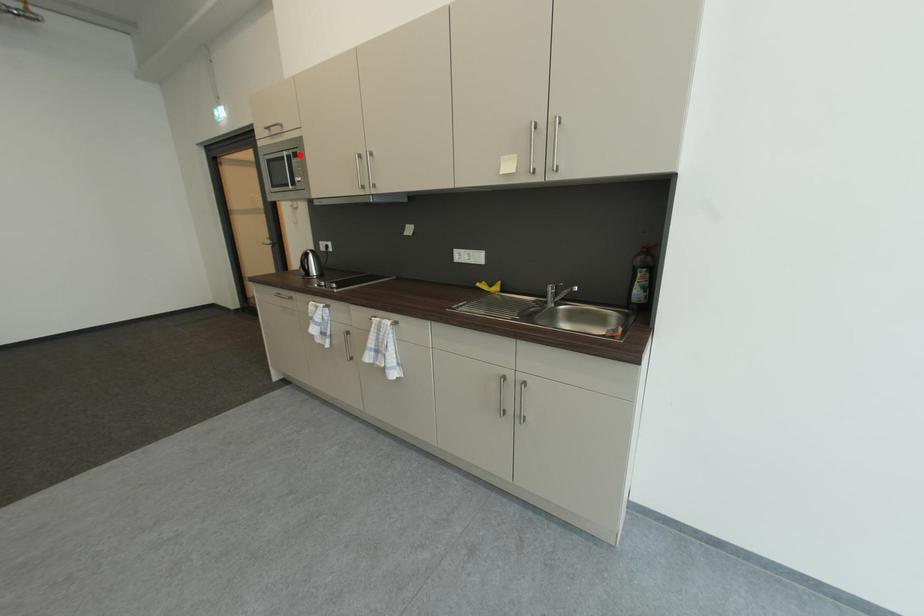
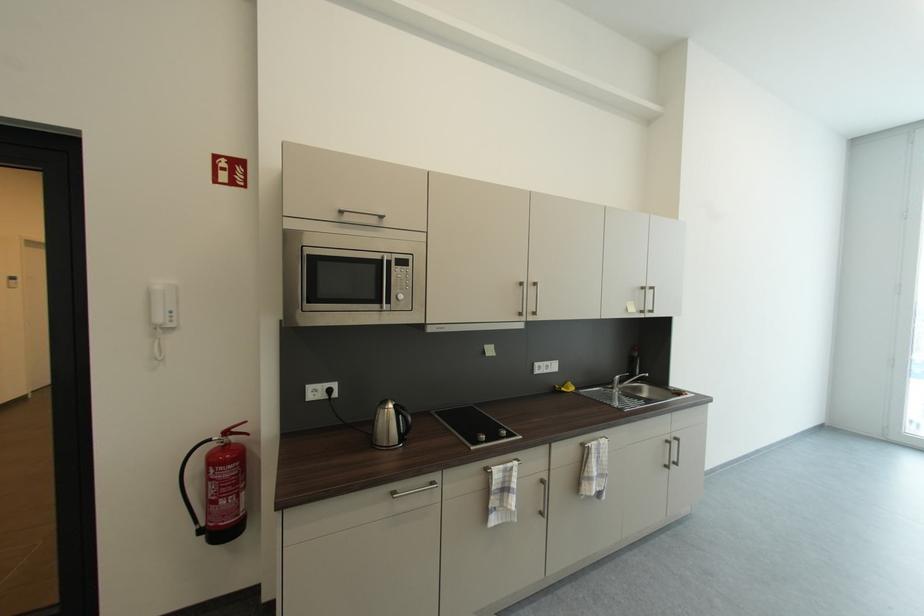
In the second image, find the point that corresponds to the highlighted location in the first image.

(403, 261)